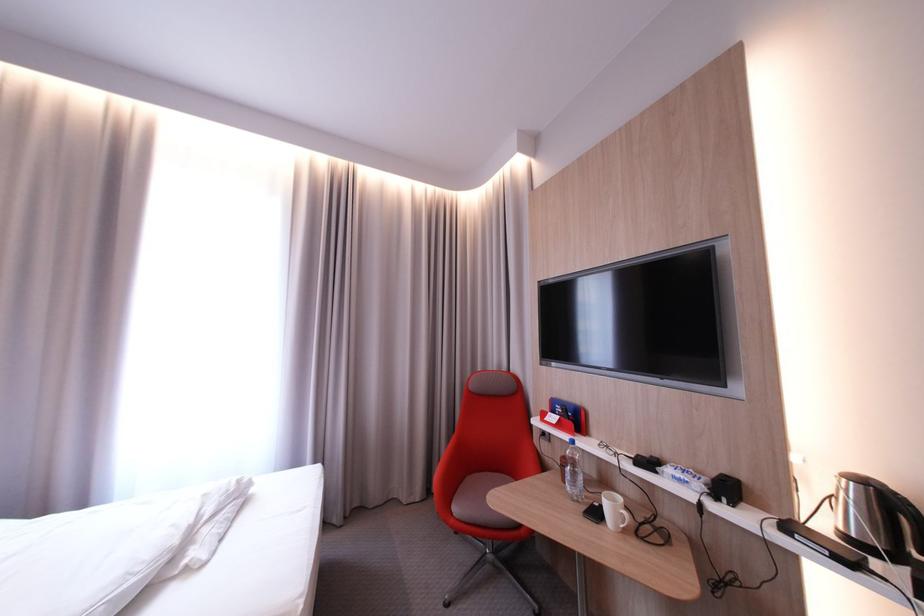
Image resolution: width=924 pixels, height=616 pixels. Find the location of `white tissue package`. white tissue package is located at coordinates (685, 477).